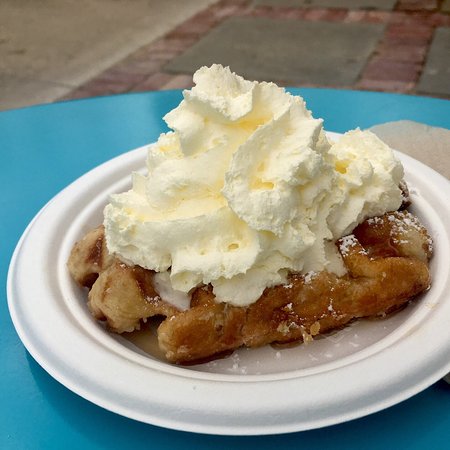
This screenshot has height=450, width=450. I want to click on table, so click(x=71, y=154).